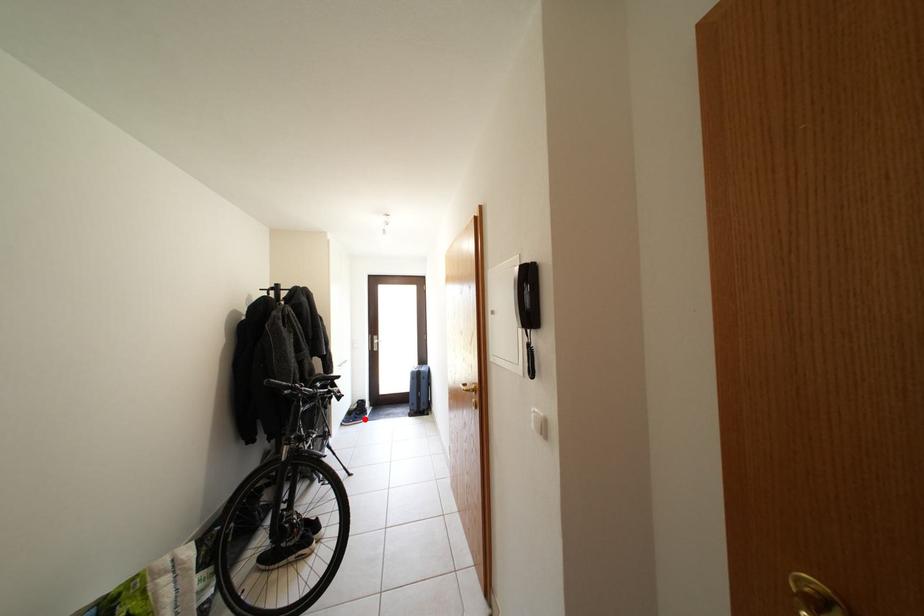
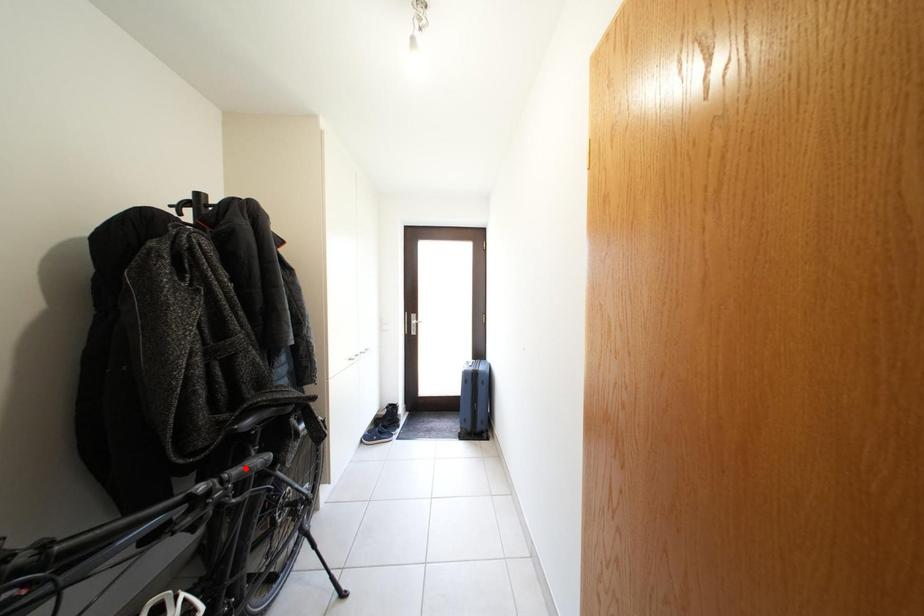
I am providing you with two images of the same scene from different viewpoints. A red point is marked on the first image and another point is marked on the second image. Do the highlighted points in image1 and image2 indicate the same real-world spot?

No